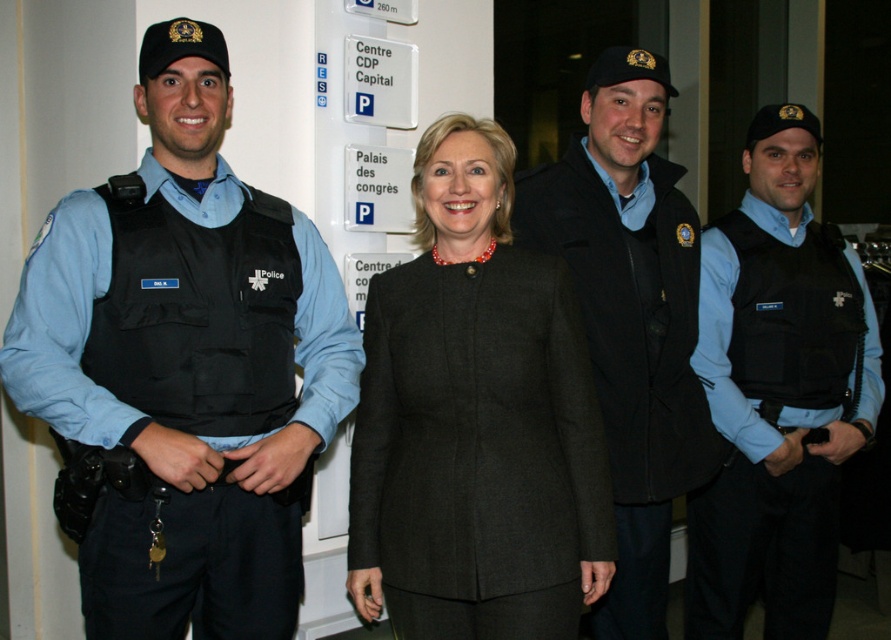
Is black matte vest at left thinner than black matte vest at center?

No, black matte vest at left is not thinner than black matte vest at center.

Who is more distant from viewer, (274, 380) or (728, 221)?

Positioned behind is point (728, 221).

Which is in front, point (290, 577) or point (749, 595)?

Positioned in front is point (290, 577).

At what (x,y) coordinates should I click in order to perform the action: click on black matte vest at left. Please return your answer as a coordinate pair (x, y). Looking at the image, I should click on (185, 364).

Describe the element at coordinates (475, 419) in the screenshot. I see `dark gray wool coat at center` at that location.

Who is more distant from viewer, (530, 296) or (579, 218)?

The point (579, 218) is more distant.

The height and width of the screenshot is (640, 891). What are the coordinates of `dark gray wool coat at center` in the screenshot? It's located at (475, 419).

Where is `black matte vest at center`? This screenshot has height=640, width=891. black matte vest at center is located at coordinates (777, 392).

Measure the distance between point [736,417] and camera.

Point [736,417] and camera are 7.26 feet apart from each other.

Which is behind, point (805, 547) or point (657, 186)?

Positioned behind is point (805, 547).

Locate an element on the screen. This screenshot has height=640, width=891. black matte vest at center is located at coordinates (777, 392).